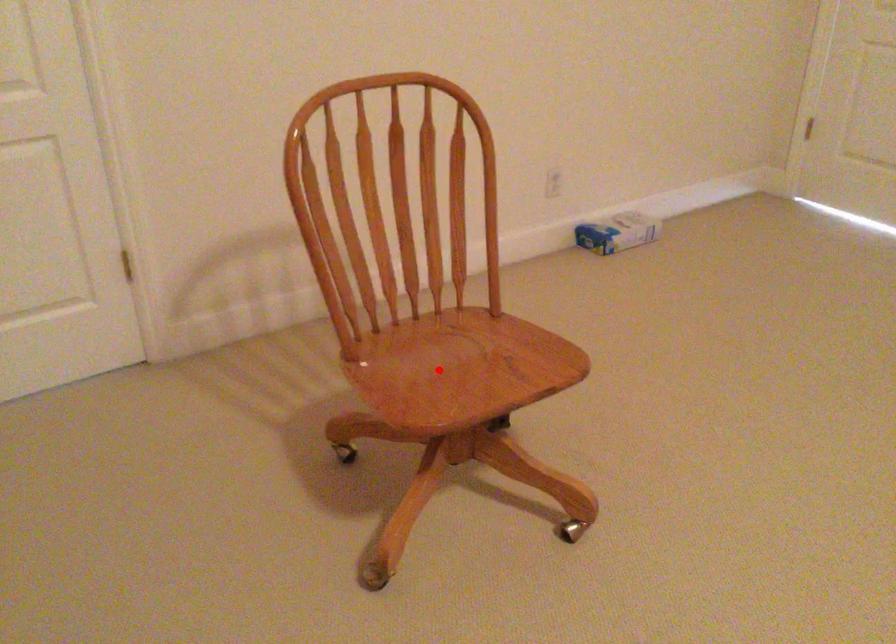
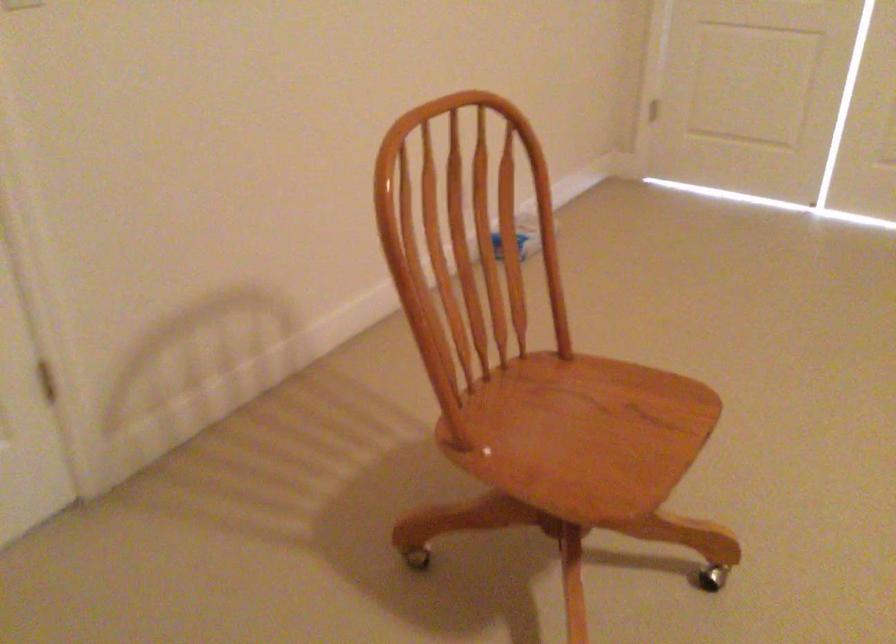
Question: I am providing you with two images of the same scene from different viewpoints. Image1 has a red point marked. In image2, the corresponding 3D location appears at what relative position? Reply with the corresponding letter.

Choices:
 (A) Closer
 (B) Farther

Answer: (A)